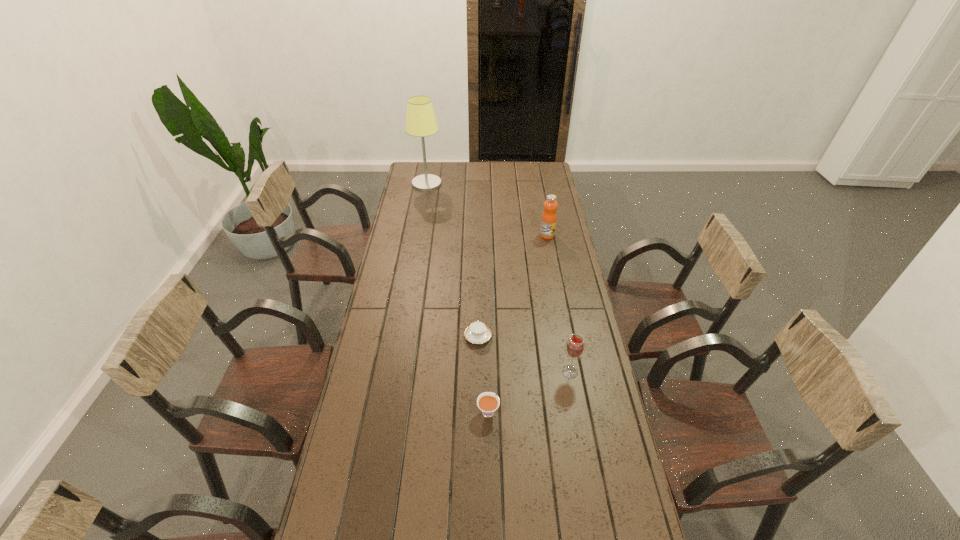
Where is `vacant area located on the right of the table lamp`? The image size is (960, 540). vacant area located on the right of the table lamp is located at coordinates (482, 184).

Where is `free space located 0.220m on the left of the fourth shortest object`? This screenshot has width=960, height=540. free space located 0.220m on the left of the fourth shortest object is located at coordinates click(x=494, y=235).

Find the location of a particular element. free space located 0.300m on the back of the fourth farthest object is located at coordinates (558, 303).

The height and width of the screenshot is (540, 960). Find the location of `vacant area located on the side of the fourth tallest object with the handle`. vacant area located on the side of the fourth tallest object with the handle is located at coordinates (488, 382).

Where is `free spot located on the side of the fourth tallest object with the handle`? free spot located on the side of the fourth tallest object with the handle is located at coordinates (487, 343).

Find the location of a particular element. This screenshot has height=540, width=960. vacant space situated 0.380m on the side of the fourth tallest object with the handle is located at coordinates (487, 315).

This screenshot has height=540, width=960. Find the location of `vacant space situated on the side with the handle of the shortest object`. vacant space situated on the side with the handle of the shortest object is located at coordinates (478, 281).

You are a GUI agent. You are given a task and a screenshot of the screen. Output one action in this format:
    pyautogui.click(x=<x>, y=<y>)
    Task: Click on the free point located 0.110m on the side with the handle of the shortest object
    The width and height of the screenshot is (960, 540).
    Given the screenshot: What is the action you would take?
    pyautogui.click(x=478, y=306)

Find the location of `vacant area situated on the side with the handle of the shortest object`. vacant area situated on the side with the handle of the shortest object is located at coordinates (478, 261).

The image size is (960, 540). I want to click on object situated at the far edge, so click(x=421, y=121).